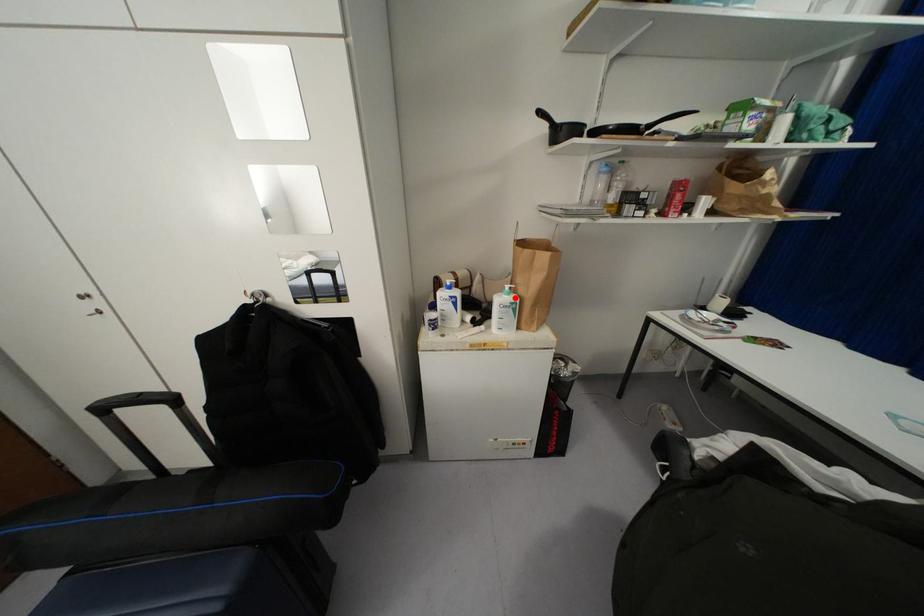
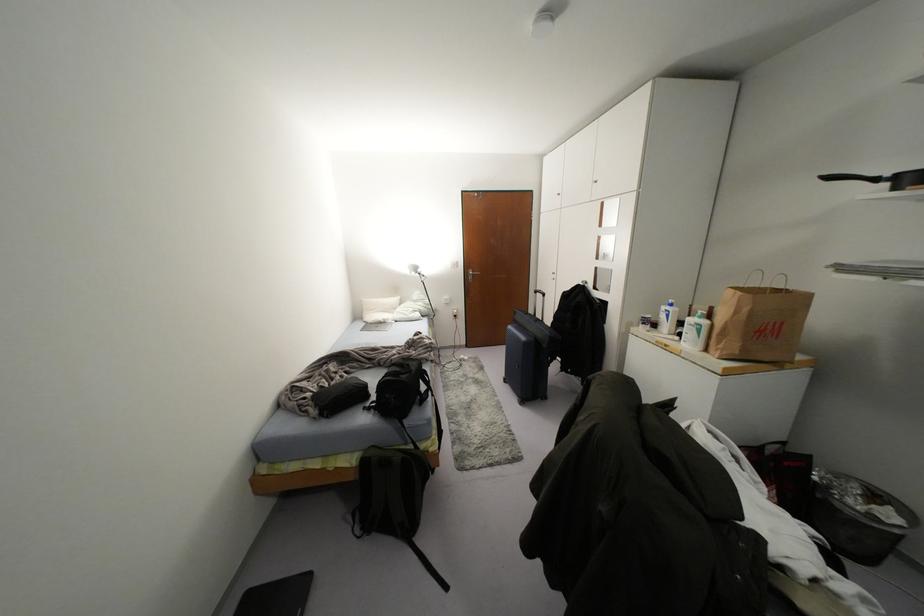
Question: I am providing you with two images of the same scene from different viewpoints. A red point is shown in image1. For the corresponding object point in image2, is it positioned nearer or farther from the camera?

Choices:
 (A) Nearer
 (B) Farther

Answer: (A)